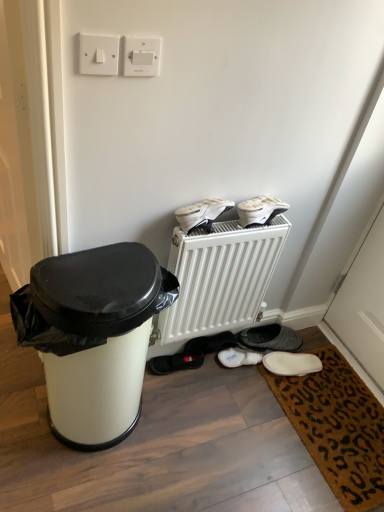
Question: Considering their positions, is white plastic switch at upper left, which appears as the second electric outlet when viewed from the right, located in front of or behind white matte sneakers at upper center, arranged as the 2th footwear when viewed from the back?

Choices:
 (A) behind
 (B) front

Answer: (B)

Question: From a real-world perspective, relative to white matte sneakers at upper center, which ranks as the third footwear in bottom-to-top order, is white plastic switch at upper left, which appears as the second electric outlet when viewed from the right, vertically above or below?

Choices:
 (A) below
 (B) above

Answer: (B)

Question: Which is nearer to the white suede slippers at lower center, the first footwear when ordered from bottom to top?

Choices:
 (A) white matte plastic trash can at left
 (B) white plastic switch at upper center, marked as the first electric outlet in a right-to-left arrangement
 (C) brown coir mat at lower right
 (D) white plastic switch at upper left, the 1th electric outlet from the left
 (E) white matte sneakers at upper center, which is counted as the second footwear, starting from the front

Answer: (C)

Question: Which object is the closest to the white plastic radiator at center?

Choices:
 (A) white matte plastic trash can at left
 (B) white plastic switch at upper center, marked as the first electric outlet in a right-to-left arrangement
 (C) white matte sneakers at upper center, the first footwear from the top
 (D) brown coir mat at lower right
 (E) white suede slippers at lower center, the first footwear when ordered from bottom to top

Answer: (C)